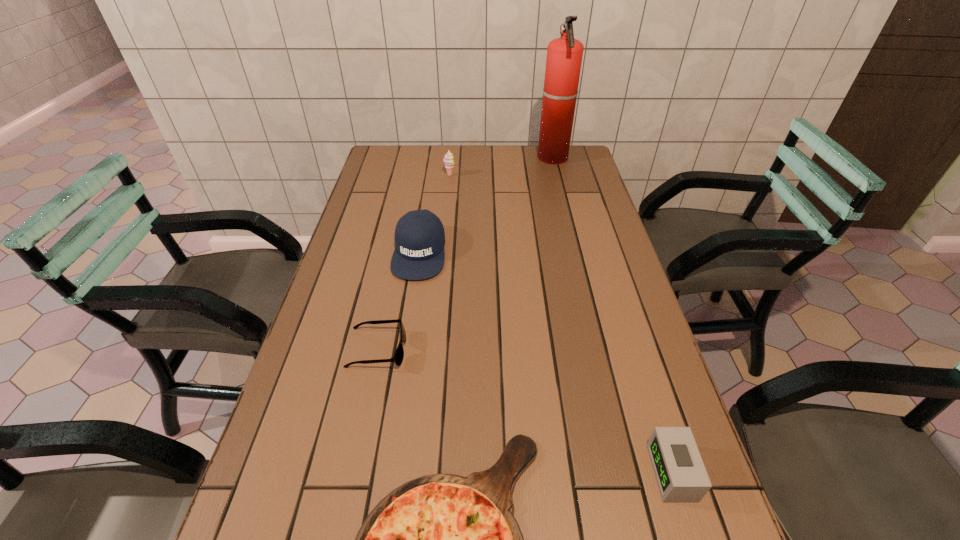
The image size is (960, 540). In order to click on alarm clock that is at the right edge in this screenshot , I will do `click(680, 473)`.

In order to click on object present at the far right corner in this screenshot , I will do `click(564, 55)`.

The height and width of the screenshot is (540, 960). Find the location of `vacant space at the far edge`. vacant space at the far edge is located at coordinates (541, 174).

Where is `free space at the left edge of the desktop`? The image size is (960, 540). free space at the left edge of the desktop is located at coordinates (337, 448).

Where is `vacant space at the right edge of the desktop`? Image resolution: width=960 pixels, height=540 pixels. vacant space at the right edge of the desktop is located at coordinates (605, 256).

Where is `blank space at the far left corner of the desktop`? The width and height of the screenshot is (960, 540). blank space at the far left corner of the desktop is located at coordinates (387, 167).

I want to click on vacant region at the far right corner of the desktop, so click(568, 171).

Find the location of a particular element. This screenshot has height=540, width=960. free point between the alarm clock and the tallest object is located at coordinates (612, 315).

Where is `free space between the tallest object and the sherbert`? free space between the tallest object and the sherbert is located at coordinates pyautogui.click(x=501, y=166).

Identify the location of vacant area between the fourth nearest object and the sunglasses. 398,301.